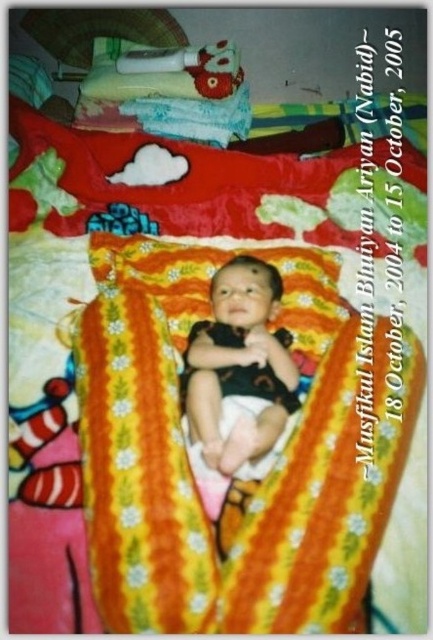
Question: Is the position of floral cotton blanket at upper center more distant than that of black matte onesie at center?

Choices:
 (A) no
 (B) yes

Answer: (B)

Question: Is the position of yellow floral blanket at center less distant than that of floral cotton blanket at upper center?

Choices:
 (A) yes
 (B) no

Answer: (A)

Question: Does floral cotton blanket at upper center appear on the left side of black matte onesie at center?

Choices:
 (A) no
 (B) yes

Answer: (B)

Question: Estimate the real-world distances between objects in this image. Which object is farther from the floral cotton blanket at upper center?

Choices:
 (A) black matte onesie at center
 (B) yellow floral blanket at center

Answer: (A)

Question: Which point appears farthest from the camera in this image?

Choices:
 (A) (109, 282)
 (B) (210, 372)

Answer: (A)

Question: Which point is farther to the camera?

Choices:
 (A) yellow floral blanket at center
 (B) floral cotton blanket at upper center

Answer: (B)